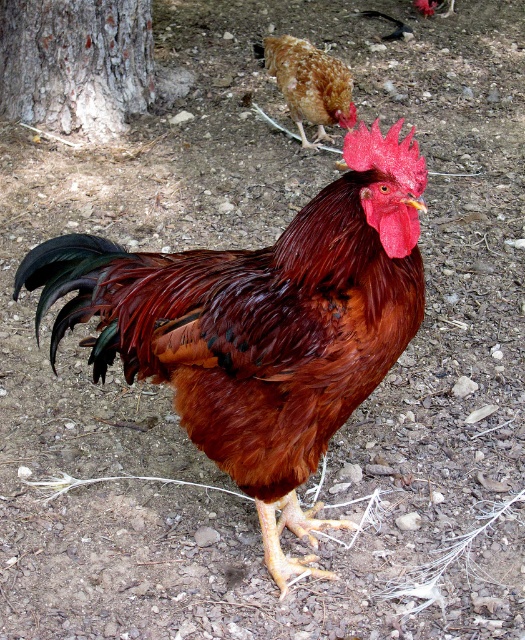
You are a farmer who needs to identify the bigger animal between the shiny brown rooster at center and the brown speckled chicken at upper center. Which one is bigger?

The shiny brown rooster at center is larger in size than the brown speckled chicken at upper center.

You are a farmer checking the size of the rough bark tree at upper left and the brown speckled chicken at upper center. Which object is bigger in size?

→ The rough bark tree at upper left is larger in size compared to the brown speckled chicken at upper center.

You are a farmer who needs to place a 2.5 meter long fence between the shiny brown rooster at center and the brown speckled chicken at upper center. Can the fence fit between them?

The shiny brown rooster at center is 2.61 meters from the brown speckled chicken at upper center, so the 2.5 meter long fence can fit between them since it is shorter than the distance between the two animals.